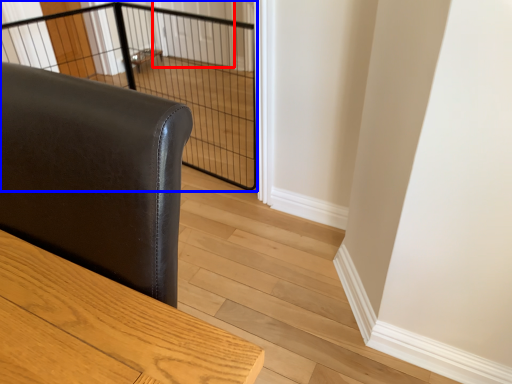
Question: Which point is further to the camera, screen door (highlighted by a red box) or cage (highlighted by a blue box)?

Choices:
 (A) screen door
 (B) cage

Answer: (A)